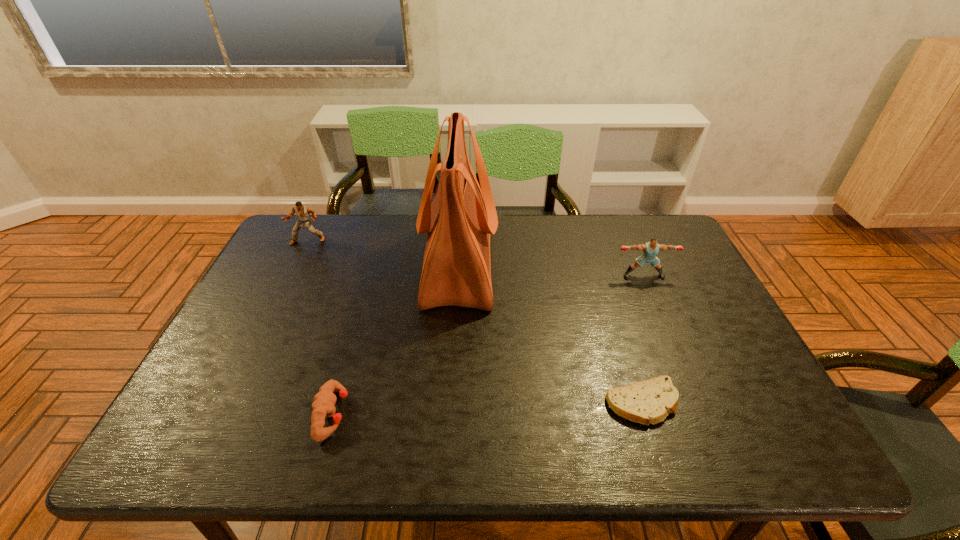
This screenshot has width=960, height=540. Identify the location of vacant region at the far edge. (367, 215).

The image size is (960, 540). Identify the location of vacant point at the near edge. (468, 433).

In the image, there is a desktop. Where is `vacant space at the left edge`? vacant space at the left edge is located at coordinates (249, 328).

You are a GUI agent. You are given a task and a screenshot of the screen. Output one action in this format:
    pyautogui.click(x=<x>, y=<y>)
    Task: Click on the vacant space at the far right corner
    The height and width of the screenshot is (540, 960).
    Given the screenshot: What is the action you would take?
    pyautogui.click(x=643, y=225)

I want to click on vacant space at the near right corner of the desktop, so click(731, 433).

The width and height of the screenshot is (960, 540). I want to click on free spot between the second nearest puncher and the nearest puncher, so click(488, 345).

Identify the location of blank region between the nearest puncher and the rightmost puncher. This screenshot has height=540, width=960. (488, 345).

Where is `blank region between the leftmost object and the tallest object`? This screenshot has height=540, width=960. blank region between the leftmost object and the tallest object is located at coordinates (383, 253).

Locate an element on the screen. Image resolution: width=960 pixels, height=540 pixels. vacant area that lies between the third object from right to left and the leftmost puncher is located at coordinates (383, 253).

Where is `vacant region between the farthest puncher and the third object from left to right`? This screenshot has height=540, width=960. vacant region between the farthest puncher and the third object from left to right is located at coordinates (383, 253).